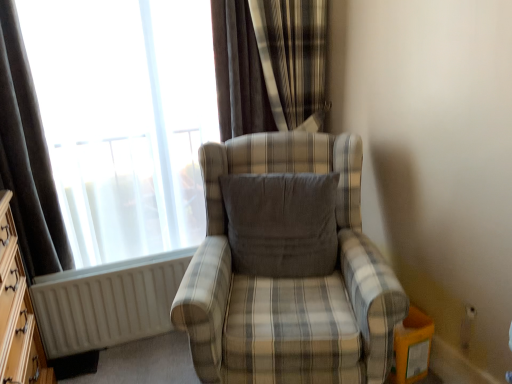
Question: Can you confirm if plaid fabric chair at center is taller than wooden dresser at left?

Choices:
 (A) yes
 (B) no

Answer: (A)

Question: Are plaid fabric chair at center and wooden dresser at left far apart?

Choices:
 (A) no
 (B) yes

Answer: (A)

Question: Can you confirm if plaid fabric chair at center is shorter than wooden dresser at left?

Choices:
 (A) yes
 (B) no

Answer: (B)

Question: From a real-world perspective, does plaid fabric chair at center sit lower than wooden dresser at left?

Choices:
 (A) no
 (B) yes

Answer: (B)

Question: From the image's perspective, does plaid fabric chair at center appear lower than wooden dresser at left?

Choices:
 (A) yes
 (B) no

Answer: (B)

Question: Is wooden dresser at left a part of plaid fabric chair at center?

Choices:
 (A) no
 (B) yes

Answer: (A)

Question: Considering the relative sizes of matte glass window at upper left and wooden dresser at left in the image provided, is matte glass window at upper left wider than wooden dresser at left?

Choices:
 (A) no
 (B) yes

Answer: (A)

Question: Considering the relative sizes of matte glass window at upper left and wooden dresser at left in the image provided, is matte glass window at upper left thinner than wooden dresser at left?

Choices:
 (A) yes
 (B) no

Answer: (A)

Question: From the image's perspective, is matte glass window at upper left located beneath wooden dresser at left?

Choices:
 (A) no
 (B) yes

Answer: (A)

Question: Is the depth of matte glass window at upper left less than that of wooden dresser at left?

Choices:
 (A) yes
 (B) no

Answer: (B)

Question: Can you confirm if matte glass window at upper left is positioned to the right of wooden dresser at left?

Choices:
 (A) no
 (B) yes

Answer: (B)

Question: Is the position of matte glass window at upper left more distant than that of wooden dresser at left?

Choices:
 (A) no
 (B) yes

Answer: (B)

Question: Is gray fabric pillow at center further to the viewer compared to wooden dresser at left?

Choices:
 (A) yes
 (B) no

Answer: (A)